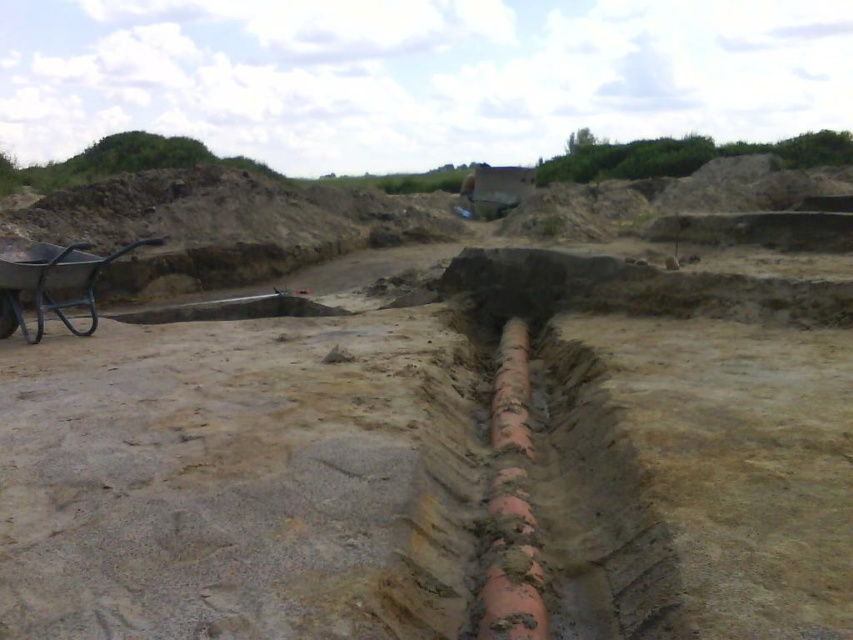
Question: Among these points, which one is nearest to the camera?

Choices:
 (A) (21, 273)
 (B) (495, 476)

Answer: (B)

Question: Does rusty clay pipe at center have a smaller size compared to metallic wheelbarrow at left?

Choices:
 (A) no
 (B) yes

Answer: (A)

Question: Can you confirm if rusty clay pipe at center is bigger than metallic wheelbarrow at left?

Choices:
 (A) no
 (B) yes

Answer: (B)

Question: Can you confirm if rusty clay pipe at center is positioned to the right of metallic wheelbarrow at left?

Choices:
 (A) no
 (B) yes

Answer: (B)